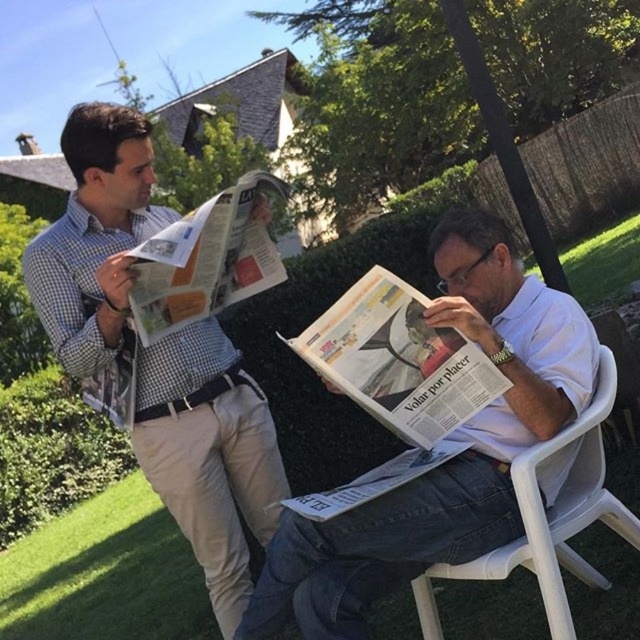
Based on the scene description, what is located at the coordinates point (397, 358)?

The point (397, 358) indicates the location of the white glossy newspaper at center.

You are a photographer trying to capture a photo of the checkered fabric shirt at left and the matte newspaper at upper left. Which object should you focus on first if you want to ensure both are in sharp focus, considering their heights?

The checkered fabric shirt at left is taller than the matte newspaper at upper left. To ensure both are in sharp focus, focus on the checkered fabric shirt at left since it is taller and likely farther away, which will help the depth of field cover both objects.